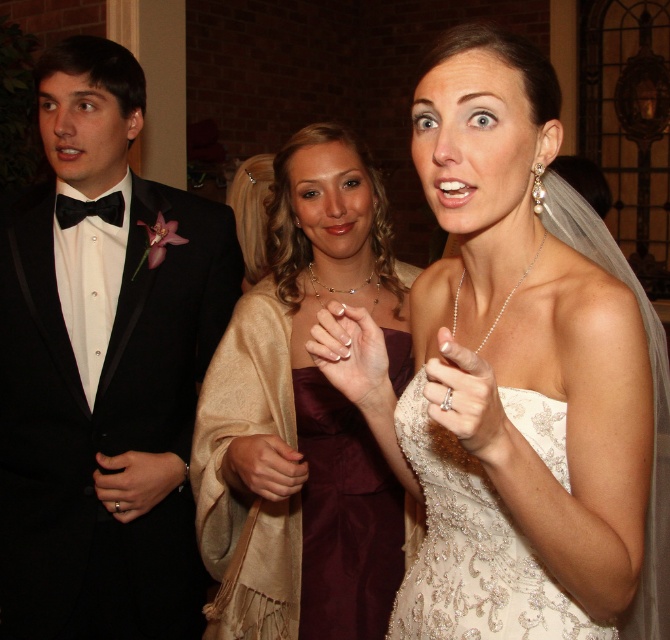
This screenshot has height=640, width=670. Describe the element at coordinates (103, 368) in the screenshot. I see `black satin tuxedo at left` at that location.

Can you confirm if black satin tuxedo at left is wider than satin gold dress at center?

Yes, black satin tuxedo at left is wider than satin gold dress at center.

Between point (107, 429) and point (194, 492), which one is positioned behind?

The point (107, 429) is more distant.

This screenshot has width=670, height=640. I want to click on black satin tuxedo at left, so click(103, 368).

Which is above, satin gold dress at center or ivory lace dress at center?

satin gold dress at center is above.

Can you confirm if satin gold dress at center is positioned below ivory lace dress at center?

Incorrect, satin gold dress at center is not positioned below ivory lace dress at center.

Is point (340, 278) positioned behind point (387, 632)?

Yes, it is behind point (387, 632).

At what (x,y) coordinates should I click in order to perform the action: click on satin gold dress at center. Please return your answer as a coordinate pair (x, y). Looking at the image, I should click on (304, 416).

Can you confirm if black satin tuxedo at left is positioned to the left of ivory lace dress at center?

Yes, black satin tuxedo at left is to the left of ivory lace dress at center.

Who is lower down, black satin tuxedo at left or ivory lace dress at center?

ivory lace dress at center

This screenshot has height=640, width=670. What do you see at coordinates (103, 368) in the screenshot? I see `black satin tuxedo at left` at bounding box center [103, 368].

Identify the location of black satin tuxedo at left. This screenshot has height=640, width=670. (103, 368).